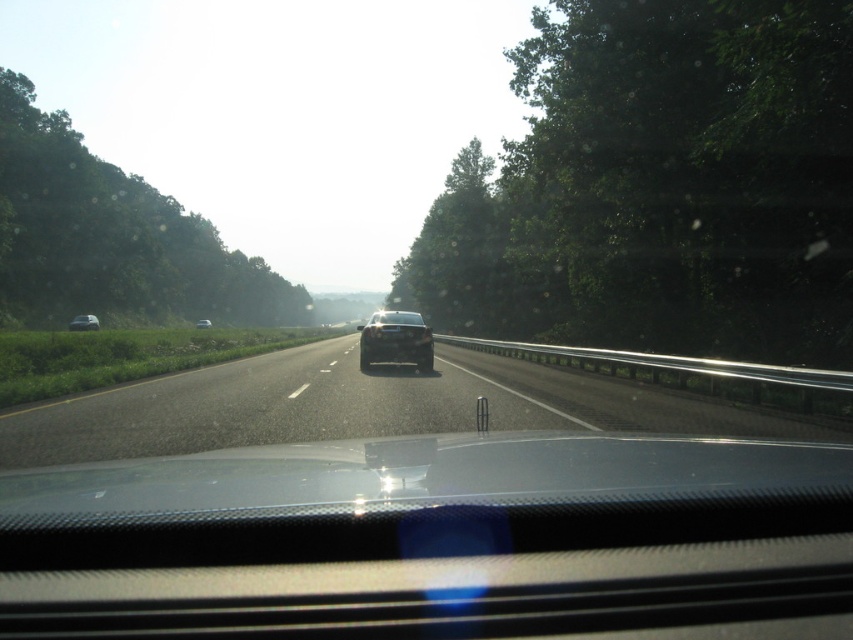
You are driving a car and see the satin black sedan at center ahead of you. If your car is 4.5 meters long, can you safely pass it within the next 50 meters without hitting any obstacles?

The satin black sedan at center is 21.81 meters away from viewer. Since the sedan is 21.81 meters ahead and your car is 4.5 meters long, you have enough space to pass safely within 50 meters as 21.81 plus 4.5 equals 26.31 meters, which is less than 50 meters. However, this calculation assumes no other vehicles or obstacles are present on the road.

You are driving on a highway and see two points on the road ahead. The first point is at coordinates point (416, 337) and the second is at point (91, 324). Which point is closer to your current position?

Point (91, 324) is closer to your current position because it is behind point (416, 337), which is in front of it.

You are driving a car and see two sedans ahead on the highway. The satin black sedan at center and the white glossy sedan at center are both in your line of sight. Which one is closer to you?

The satin black sedan at center is closer to you because it is positioned in front of the white glossy sedan at center.